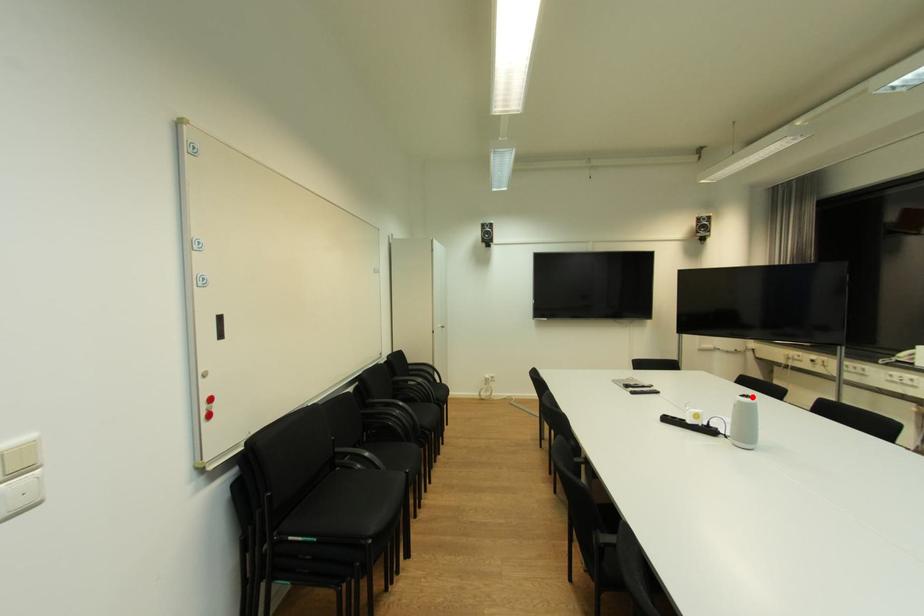
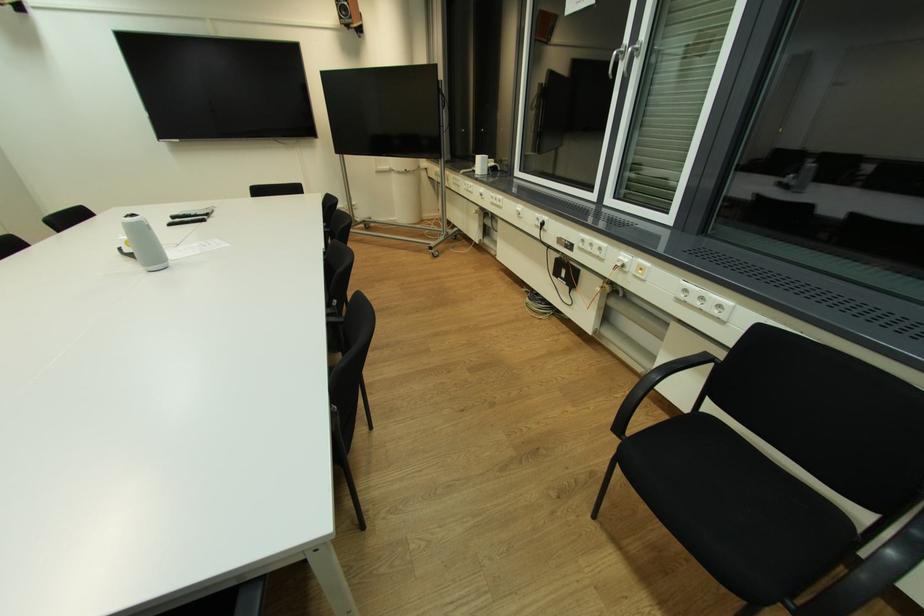
Find the pixel in the second image that matches the highlighted location in the first image.

(137, 216)